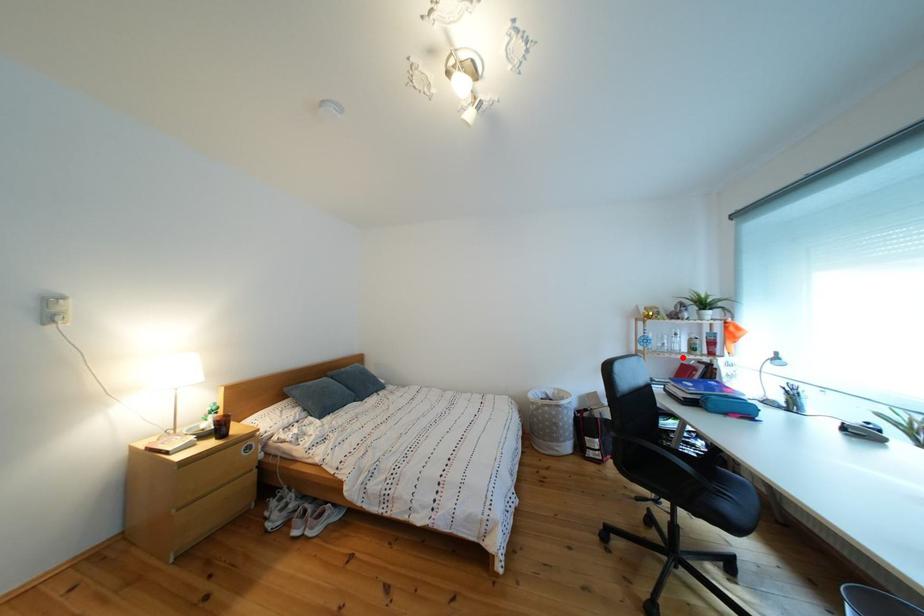
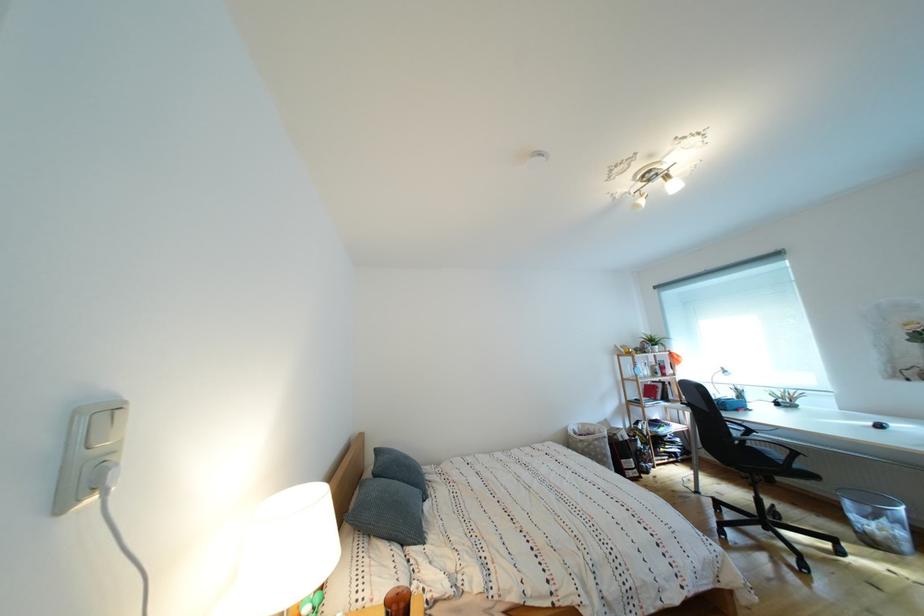
The point at the highlighted location is marked in the first image. Where is the corresponding point in the second image?

(657, 383)